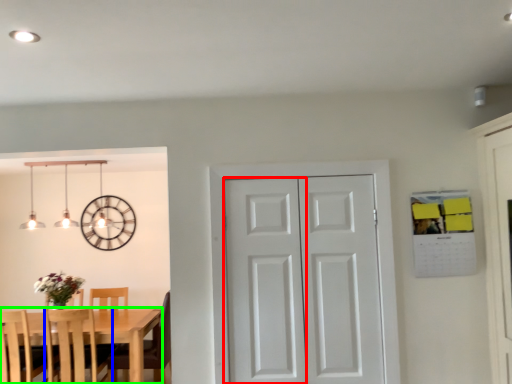
Question: Estimate the real-world distances between objects in this image. Which object is farther from screen door (highlighted by a red box), chair (highlighted by a blue box) or kitchen & dining room table (highlighted by a green box)?

Choices:
 (A) chair
 (B) kitchen & dining room table

Answer: (A)